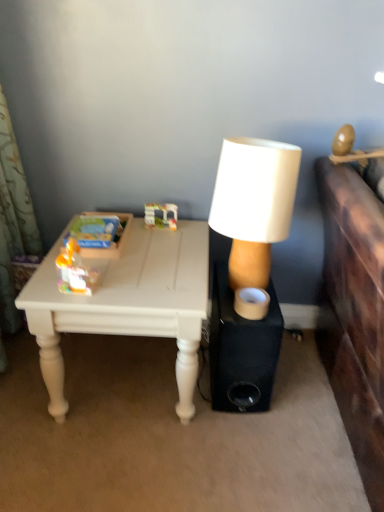
This screenshot has height=512, width=384. Find the location of `free space that is in between translucent plastic toy at center, marked as the 2th toy in a front-to-back arrangement, and matte plastic toy at left, placed as the 1th toy when sorted from bottom to top`. free space that is in between translucent plastic toy at center, marked as the 2th toy in a front-to-back arrangement, and matte plastic toy at left, placed as the 1th toy when sorted from bottom to top is located at coordinates 132,250.